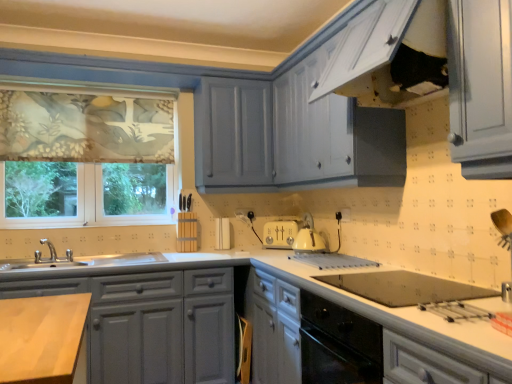
In order to face white glossy oven at lower center, which is the second cabinetry in left-to-right order, should I rotate leftwards or rightwards?

Turn right approximately 10.269 degrees to face it.

What do you see at coordinates (153, 324) in the screenshot? This screenshot has width=512, height=384. I see `matte gray cabinets at lower left, which ranks as the 2th cabinetry in right-to-left order` at bounding box center [153, 324].

This screenshot has height=384, width=512. Describe the element at coordinates (86, 156) in the screenshot. I see `floral fabric window at left` at that location.

At what (x,y) coordinates should I click in order to perform the action: click on white glossy oven at lower center, which ranks as the 1th cabinetry in right-to-left order. Please return your answer as a coordinate pair (x, y). This screenshot has width=512, height=384. Looking at the image, I should click on (414, 324).

Does floral fabric window at left appear on the left side of matte gray cabinets at lower left, which ranks as the 2th cabinetry in right-to-left order?

Yes.

Find the location of a particular element. Image resolution: width=512 pixels, height=384 pixels. window on the left of the matte gray cabinets at lower left, which ranks as the 2th cabinetry in right-to-left order is located at coordinates (86, 156).

From a real-world perspective, who is located higher, floral fabric window at left or matte gray cabinets at lower left, which ranks as the 2th cabinetry in right-to-left order?

In real-world perspective, floral fabric window at left is above.

Can you confirm if floral fabric window at left is wider than matte gray cabinets at lower left, placed as the first cabinetry when sorted from left to right?

In fact, floral fabric window at left might be narrower than matte gray cabinets at lower left, placed as the first cabinetry when sorted from left to right.

From a real-world perspective, is floral fabric window at left under white glossy oven at lower center, which ranks as the 1th cabinetry in right-to-left order?

No, from a real-world perspective, floral fabric window at left is not under white glossy oven at lower center, which ranks as the 1th cabinetry in right-to-left order.

Does floral fabric window at left have a smaller size compared to white glossy oven at lower center, which ranks as the 1th cabinetry in right-to-left order?

Yes, floral fabric window at left is smaller than white glossy oven at lower center, which ranks as the 1th cabinetry in right-to-left order.

This screenshot has width=512, height=384. I want to click on window that appears above the white glossy oven at lower center, which is the second cabinetry in left-to-right order (from a real-world perspective), so click(x=86, y=156).

Is floral fabric window at left looking in the opposite direction of white glossy oven at lower center, which ranks as the 1th cabinetry in right-to-left order?

No.

Considering the sizes of objects matte gray cabinets at lower left, which ranks as the 2th cabinetry in right-to-left order, and floral fabric window at left in the image provided, who is smaller, matte gray cabinets at lower left, which ranks as the 2th cabinetry in right-to-left order, or floral fabric window at left?

Smaller between the two is floral fabric window at left.

Does matte gray cabinets at lower left, which ranks as the 2th cabinetry in right-to-left order, turn towards floral fabric window at left?

No, matte gray cabinets at lower left, which ranks as the 2th cabinetry in right-to-left order, is not oriented towards floral fabric window at left.

Does matte gray cabinets at lower left, which ranks as the 2th cabinetry in right-to-left order, appear on the left side of floral fabric window at left?

No.

Can you tell me how much matte gray cabinets at lower left, which ranks as the 2th cabinetry in right-to-left order, and floral fabric window at left differ in facing direction?

The angular difference between matte gray cabinets at lower left, which ranks as the 2th cabinetry in right-to-left order, and floral fabric window at left is 0.00205 degrees.

From the image's perspective, relative to floral fabric window at left, is white glossy oven at lower center, which is the second cabinetry in left-to-right order, above or below?

Based on their image positions, white glossy oven at lower center, which is the second cabinetry in left-to-right order, is located beneath floral fabric window at left.

Is there a large distance between white glossy oven at lower center, which is the second cabinetry in left-to-right order, and floral fabric window at left?

Yes.

Is white glossy oven at lower center, which is the second cabinetry in left-to-right order, thinner than floral fabric window at left?

In fact, white glossy oven at lower center, which is the second cabinetry in left-to-right order, might be wider than floral fabric window at left.

Is matte gray cabinets at lower left, placed as the first cabinetry when sorted from left to right, beside white glossy oven at lower center, which ranks as the 1th cabinetry in right-to-left order?

There is a gap between matte gray cabinets at lower left, placed as the first cabinetry when sorted from left to right, and white glossy oven at lower center, which ranks as the 1th cabinetry in right-to-left order.

Considering the relative sizes of matte gray cabinets at lower left, placed as the first cabinetry when sorted from left to right, and white glossy oven at lower center, which is the second cabinetry in left-to-right order, in the image provided, is matte gray cabinets at lower left, placed as the first cabinetry when sorted from left to right, shorter than white glossy oven at lower center, which is the second cabinetry in left-to-right order,?

Yes.

Can you confirm if matte gray cabinets at lower left, placed as the first cabinetry when sorted from left to right, is bigger than white glossy oven at lower center, which ranks as the 1th cabinetry in right-to-left order?

No, matte gray cabinets at lower left, placed as the first cabinetry when sorted from left to right, is not bigger than white glossy oven at lower center, which ranks as the 1th cabinetry in right-to-left order.

Is white glossy oven at lower center, which ranks as the 1th cabinetry in right-to-left order, facing away from matte gray cabinets at lower left, placed as the first cabinetry when sorted from left to right?

No.

Which of these two, white glossy oven at lower center, which is the second cabinetry in left-to-right order, or matte gray cabinets at lower left, which ranks as the 2th cabinetry in right-to-left order, is smaller?

matte gray cabinets at lower left, which ranks as the 2th cabinetry in right-to-left order.

Between white glossy oven at lower center, which ranks as the 1th cabinetry in right-to-left order, and matte gray cabinets at lower left, placed as the first cabinetry when sorted from left to right, which one is positioned behind?

matte gray cabinets at lower left, placed as the first cabinetry when sorted from left to right, is further away from the camera.

This screenshot has width=512, height=384. I want to click on the 1st cabinetry counting from the right side of the floral fabric window at left, so click(x=153, y=324).

Starting from the floral fabric window at left, which cabinetry is the 2nd one in front? Please provide its 2D coordinates.

[(414, 324)]

Estimate the real-world distances between objects in this image. Which object is further from matte gray cabinets at lower left, placed as the first cabinetry when sorted from left to right, white glossy oven at lower center, which is the second cabinetry in left-to-right order, or floral fabric window at left?

The object further to matte gray cabinets at lower left, placed as the first cabinetry when sorted from left to right, is floral fabric window at left.

Based on their spatial positions, is floral fabric window at left or matte gray cabinets at lower left, which ranks as the 2th cabinetry in right-to-left order, further from white glossy oven at lower center, which is the second cabinetry in left-to-right order?

floral fabric window at left lies further to white glossy oven at lower center, which is the second cabinetry in left-to-right order, than the other object.

Which object lies further to the anchor point floral fabric window at left, white glossy oven at lower center, which ranks as the 1th cabinetry in right-to-left order, or matte gray cabinets at lower left, placed as the first cabinetry when sorted from left to right?

white glossy oven at lower center, which ranks as the 1th cabinetry in right-to-left order, lies further to floral fabric window at left than the other object.

When comparing their distances from white glossy oven at lower center, which ranks as the 1th cabinetry in right-to-left order, does matte gray cabinets at lower left, placed as the first cabinetry when sorted from left to right, or floral fabric window at left seem closer?

The object closer to white glossy oven at lower center, which ranks as the 1th cabinetry in right-to-left order, is matte gray cabinets at lower left, placed as the first cabinetry when sorted from left to right.

When comparing their distances from floral fabric window at left, does matte gray cabinets at lower left, placed as the first cabinetry when sorted from left to right, or white glossy oven at lower center, which ranks as the 1th cabinetry in right-to-left order, seem closer?

Based on the image, matte gray cabinets at lower left, placed as the first cabinetry when sorted from left to right, appears to be nearer to floral fabric window at left.

Estimate the real-world distances between objects in this image. Which object is further from matte gray cabinets at lower left, which ranks as the 2th cabinetry in right-to-left order, floral fabric window at left or white glossy oven at lower center, which ranks as the 1th cabinetry in right-to-left order?

floral fabric window at left is further to matte gray cabinets at lower left, which ranks as the 2th cabinetry in right-to-left order.

You are a GUI agent. You are given a task and a screenshot of the screen. Output one action in this format:
    pyautogui.click(x=<x>, y=<y>)
    Task: Click on the cabinetry located between floral fabric window at left and white glossy oven at lower center, which is the second cabinetry in left-to-right order, in the left-right direction
    This screenshot has height=384, width=512.
    Given the screenshot: What is the action you would take?
    pyautogui.click(x=153, y=324)